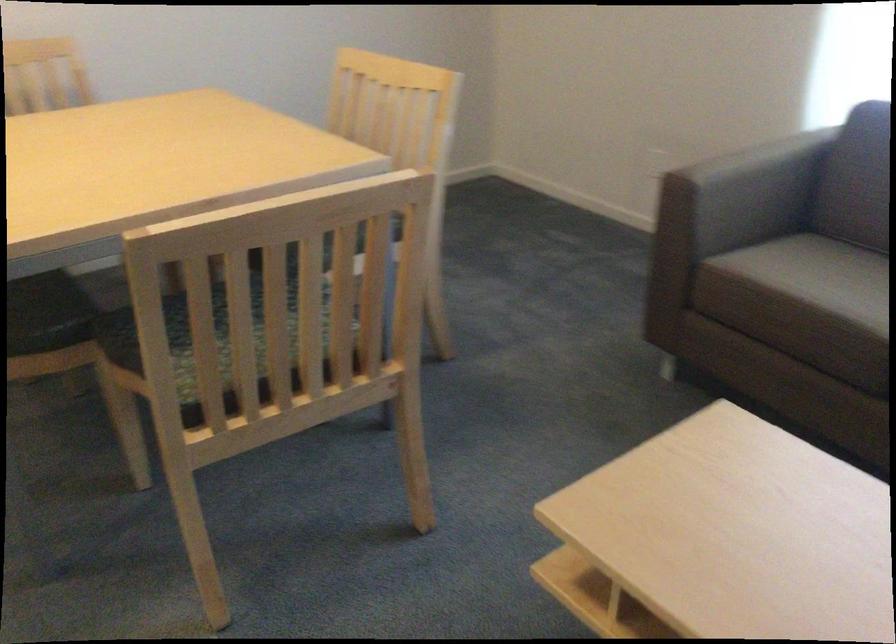
This screenshot has height=644, width=896. Find the location of `chair sitting surface`. chair sitting surface is located at coordinates (211, 334).